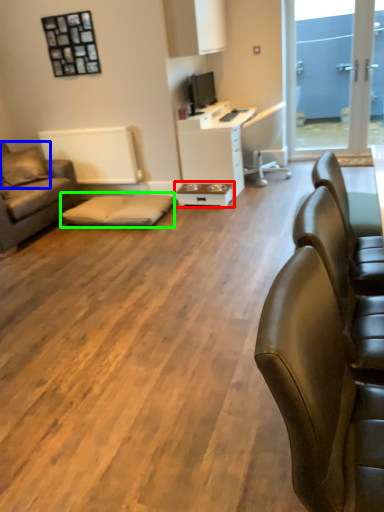
Question: Which is farther away from table (highlighted by a red box)? pillow (highlighted by a blue box) or bar stool (highlighted by a green box)?

Choices:
 (A) pillow
 (B) bar stool

Answer: (A)